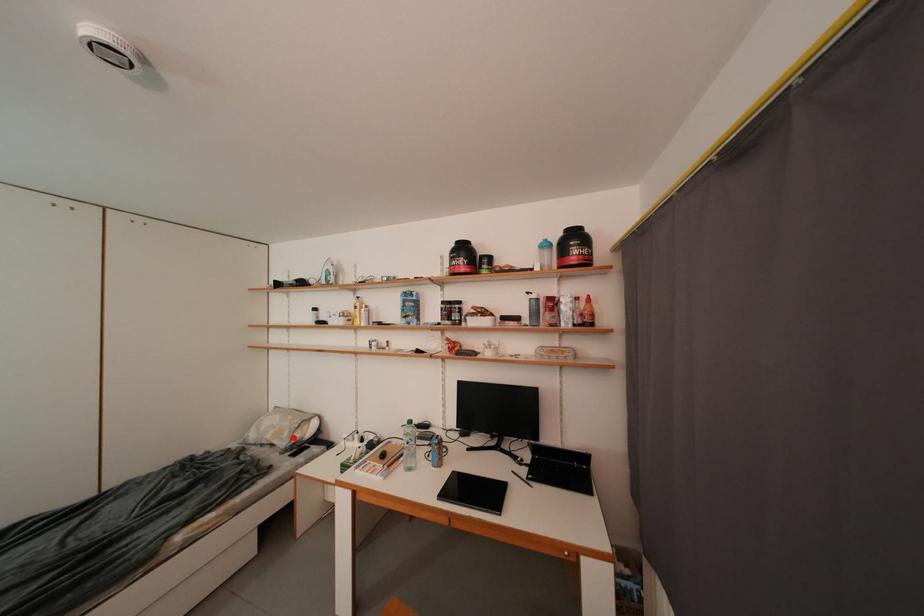
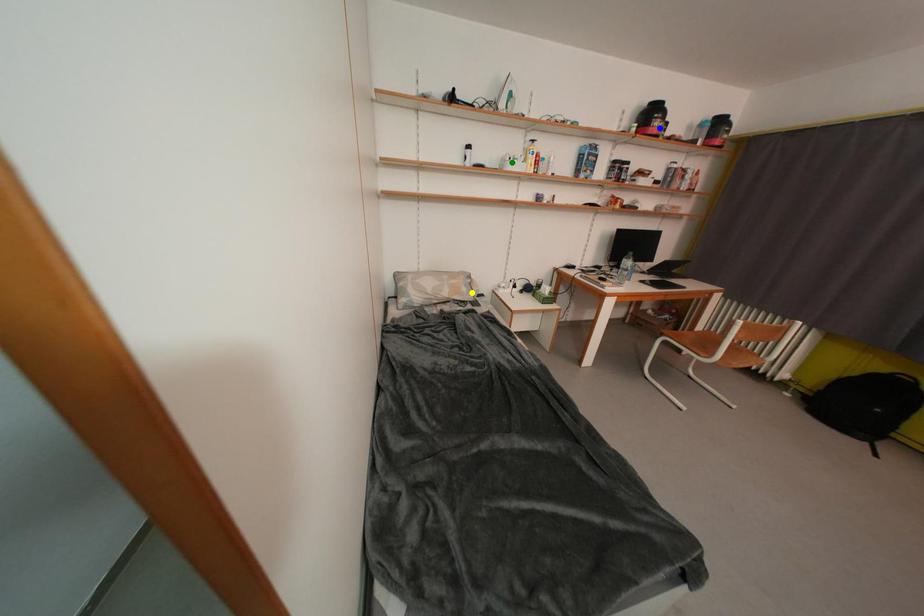
Question: I am providing you with two images of the same scene from different viewpoints. A red point is marked on the first image. You are given multiple points on the second image. Can you choose the point in image 2 that corresponds to the point in image 1?

Choices:
 (A) yellow point
 (B) blue point
 (C) green point

Answer: (A)